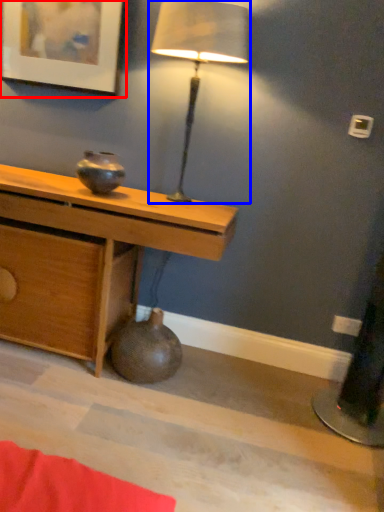
Question: Which object appears closest to the camera in this image, picture frame (highlighted by a red box) or lamp (highlighted by a blue box)?

Choices:
 (A) picture frame
 (B) lamp

Answer: (B)